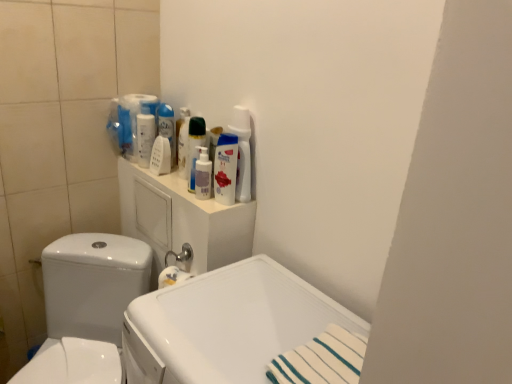
Question: Considering the positions of point (150, 264) and point (236, 137), is point (150, 264) closer or farther from the camera than point (236, 137)?

Choices:
 (A) farther
 (B) closer

Answer: (A)

Question: In terms of width, does white glossy toilet at left look wider or thinner when compared to white glossy bottle at upper center, acting as the fourth cleaning product starting from the left?

Choices:
 (A) thin
 (B) wide

Answer: (B)

Question: Estimate the real-world distances between objects in this image. Which object is closer to the white glossy mouthwash at upper center, positioned as the 1th mouthwash in back-to-front order?

Choices:
 (A) white plastic medicine cabinet at upper center
 (B) white glossy spray bottle at upper center, which is counted as the first cleaning product, starting from the left
 (C) white glossy bottle at upper center, acting as the fourth cleaning product starting from the left
 (D) translucent plastic pump bottle at center, which appears as the 2th cleaning product when viewed from the right
 (E) white glossy sink at center

Answer: (B)

Question: Estimate the real-world distances between objects in this image. Which object is farther from the white glossy bottle at upper center, which is counted as the 1th cleaning product, starting from the right?

Choices:
 (A) white glossy sink at center
 (B) white glossy mouthwash at upper center, positioned as the 1th mouthwash in back-to-front order
 (C) white glossy bottle at upper center, the 3th cleaning product viewed from the right
 (D) white glossy toilet at left
 (E) white glossy spray bottle at upper center, which is the 4th cleaning product from right to left

Answer: (D)